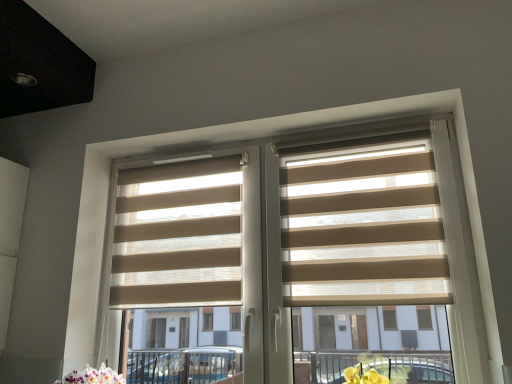
Question: Is the surface of beige fabric blinds at center, arranged as the 2th blind when viewed from the right, in direct contact with beige fabric blinds at center?

Choices:
 (A) no
 (B) yes

Answer: (A)

Question: Considering the relative positions of beige fabric blinds at center, arranged as the 2th blind when viewed from the right, and beige fabric blinds at center in the image provided, is beige fabric blinds at center, arranged as the 2th blind when viewed from the right, to the left of beige fabric blinds at center from the viewer's perspective?

Choices:
 (A) no
 (B) yes

Answer: (B)

Question: Is beige fabric blinds at center, arranged as the 2th blind when viewed from the right, positioned beyond the bounds of beige fabric blinds at center?

Choices:
 (A) yes
 (B) no

Answer: (B)

Question: Is beige fabric blinds at center, arranged as the 2th blind when viewed from the right, closer to camera compared to beige fabric blinds at center?

Choices:
 (A) yes
 (B) no

Answer: (B)

Question: Does beige fabric blinds at center, arranged as the 2th blind when viewed from the right, have a lesser height compared to beige fabric blinds at center?

Choices:
 (A) no
 (B) yes

Answer: (B)

Question: Can you confirm if beige fabric blinds at center, arranged as the 1th blind when viewed from the left, is thinner than beige fabric blinds at center?

Choices:
 (A) yes
 (B) no

Answer: (A)

Question: Is beige fabric blinds at center bigger than beige fabric blinds at center, arranged as the 2th blind when viewed from the right?

Choices:
 (A) yes
 (B) no

Answer: (A)

Question: Can you confirm if beige fabric blinds at center is taller than beige fabric blinds at center, arranged as the 1th blind when viewed from the left?

Choices:
 (A) yes
 (B) no

Answer: (A)

Question: Is beige fabric blinds at center shorter than beige fabric blinds at center, arranged as the 2th blind when viewed from the right?

Choices:
 (A) no
 (B) yes

Answer: (A)

Question: Is beige fabric blinds at center smaller than beige fabric blinds at center, arranged as the 1th blind when viewed from the left?

Choices:
 (A) no
 (B) yes

Answer: (A)

Question: From the image's perspective, is beige fabric blinds at center under beige fabric blinds at center, arranged as the 1th blind when viewed from the left?

Choices:
 (A) yes
 (B) no

Answer: (A)

Question: Would you say beige fabric blinds at center, arranged as the 1th blind when viewed from the left, is part of beige fabric blinds at center's contents?

Choices:
 (A) yes
 (B) no

Answer: (A)

Question: Is beige fabric blinds at center, arranged as the 1th blind when viewed from the left, not near beige fabric blinds at center, the second blind from the left?

Choices:
 (A) yes
 (B) no

Answer: (B)